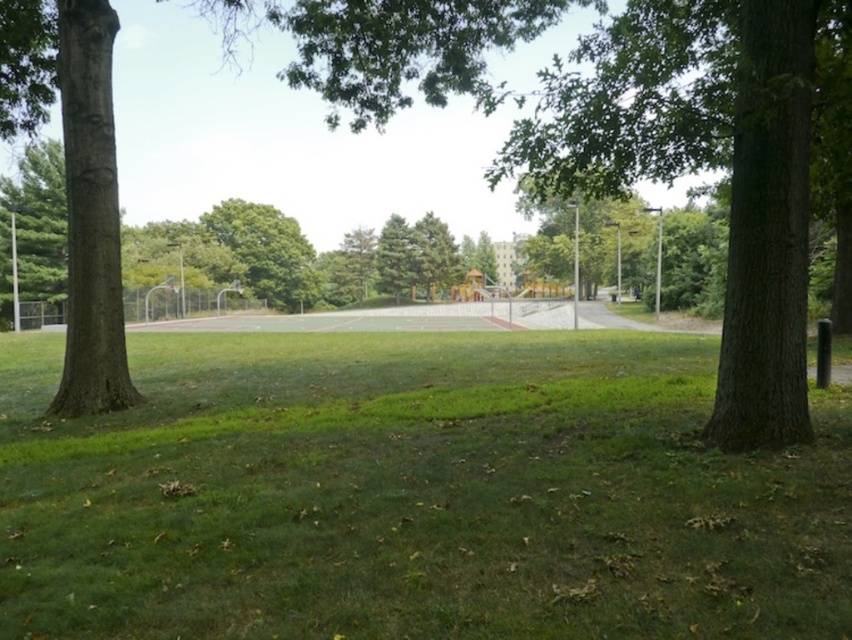
Is green grassy area at center below brown rough tree at center?

Correct, green grassy area at center is located below brown rough tree at center.

Does point (222, 616) lie in front of point (767, 307)?

Yes, point (222, 616) is in front of point (767, 307).

Between point (573, 468) and point (545, 90), which one is positioned in front?

Point (573, 468) is more forward.

Identify the location of green grassy area at center. (413, 496).